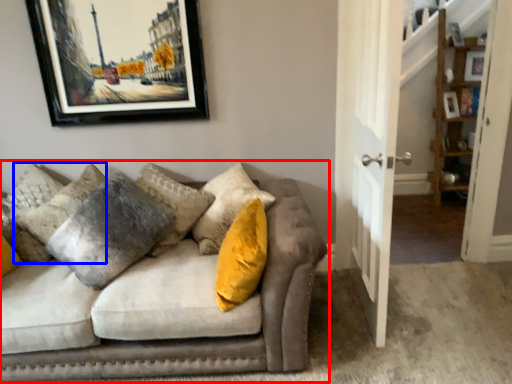
Question: Which of the following is the farthest to the observer, studio couch (highlighted by a red box) or pillow (highlighted by a blue box)?

Choices:
 (A) studio couch
 (B) pillow

Answer: (B)